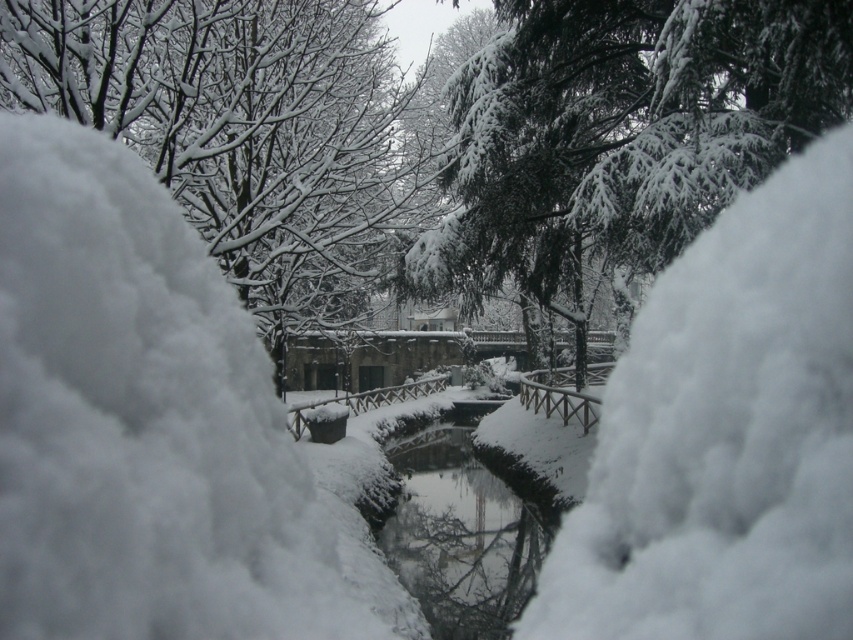
Image resolution: width=853 pixels, height=640 pixels. What do you see at coordinates (149, 428) in the screenshot?
I see `white fluffy snow at center` at bounding box center [149, 428].

From the picture: Which is more to the right, white fluffy snow at center or snowy branches at center?

From the viewer's perspective, white fluffy snow at center appears more on the right side.

The width and height of the screenshot is (853, 640). In order to click on white fluffy snow at center in this screenshot , I will do `click(149, 428)`.

Between point (149, 362) and point (433, 531), which one is positioned behind?

Point (433, 531)

Where is `white fluffy snow at center`? white fluffy snow at center is located at coordinates (149, 428).

Which of these two, snowy branches at center or smooth ice water at center, stands taller?

snowy branches at center

Who is more distant from viewer, (279, 289) or (466, 424)?

The point (466, 424) is more distant.

Who is more distant from viewer, (54, 16) or (438, 449)?

The point (438, 449) is more distant.

Where is `snowy branches at center`? The width and height of the screenshot is (853, 640). snowy branches at center is located at coordinates (236, 128).